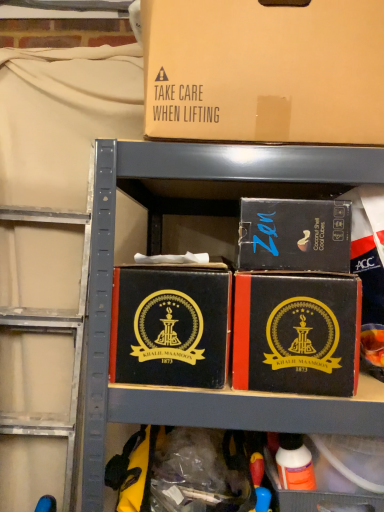
At what (x,y) coordinates should I click in order to perform the action: click on black leather box at center, which ranks as the 2th box in bottom-to-top order. Please return your answer as a coordinate pair (x, y). Image resolution: width=384 pixels, height=512 pixels. Looking at the image, I should click on (170, 325).

Identify the location of brown cardboard box at upper center, the 4th box ordered from the bottom. (264, 71).

Describe the element at coordinates (294, 234) in the screenshot. The width and height of the screenshot is (384, 512). I see `black cardboard box at center, acting as the 2th box starting from the top` at that location.

The image size is (384, 512). What do you see at coordinates (296, 333) in the screenshot? I see `black cardboard box at center, which appears as the first box when ordered from the bottom` at bounding box center [296, 333].

Find the location of `orange matte bottle at lower right`. orange matte bottle at lower right is located at coordinates (294, 463).

Who is more distant, black cardboard box at center, placed as the 3th box when sorted from bottom to top, or brown cardboard box at upper center, the 4th box ordered from the bottom?

Positioned behind is black cardboard box at center, placed as the 3th box when sorted from bottom to top.

Is black cardboard box at center, placed as the 3th box when sorted from bottom to top, far from brown cardboard box at upper center, the 4th box ordered from the bottom?

No, black cardboard box at center, placed as the 3th box when sorted from bottom to top, is not far away from brown cardboard box at upper center, the 4th box ordered from the bottom.

How distant is black cardboard box at center, placed as the 3th box when sorted from bottom to top, from brown cardboard box at upper center, marked as the first box in a top-to-bottom arrangement?

black cardboard box at center, placed as the 3th box when sorted from bottom to top, is 7.03 inches away from brown cardboard box at upper center, marked as the first box in a top-to-bottom arrangement.

Can you confirm if black cardboard box at center, which appears as the first box when ordered from the bottom, is taller than brown cardboard box at upper center, marked as the first box in a top-to-bottom arrangement?

Incorrect, the height of black cardboard box at center, which appears as the first box when ordered from the bottom, is not larger of that of brown cardboard box at upper center, marked as the first box in a top-to-bottom arrangement.

Considering the relative positions of black cardboard box at center, which appears as the first box when ordered from the bottom, and brown cardboard box at upper center, the 4th box ordered from the bottom, in the image provided, is black cardboard box at center, which appears as the first box when ordered from the bottom, to the left or to the right of brown cardboard box at upper center, the 4th box ordered from the bottom,?

Clearly, black cardboard box at center, which appears as the first box when ordered from the bottom, is on the right of brown cardboard box at upper center, the 4th box ordered from the bottom, in the image.

Considering the positions of objects black cardboard box at center, acting as the 2th box starting from the top, and orange matte bottle at lower right in the image provided, who is more to the right, black cardboard box at center, acting as the 2th box starting from the top, or orange matte bottle at lower right?

From the viewer's perspective, orange matte bottle at lower right appears more on the right side.

Is black cardboard box at center, acting as the 2th box starting from the top, positioned behind orange matte bottle at lower right?

That is False.

Considering the relative sizes of black cardboard box at center, placed as the 3th box when sorted from bottom to top, and orange matte bottle at lower right in the image provided, is black cardboard box at center, placed as the 3th box when sorted from bottom to top, shorter than orange matte bottle at lower right?

Indeed, black cardboard box at center, placed as the 3th box when sorted from bottom to top, has a lesser height compared to orange matte bottle at lower right.

From a real-world perspective, between black cardboard box at center, acting as the 2th box starting from the top, and orange matte bottle at lower right, who is vertically lower?

In real-world perspective, orange matte bottle at lower right is lower.

Visually, is brown cardboard box at upper center, the 4th box ordered from the bottom, positioned to the left or to the right of orange matte bottle at lower right?

brown cardboard box at upper center, the 4th box ordered from the bottom, is to the left of orange matte bottle at lower right.

Which of these two, brown cardboard box at upper center, marked as the first box in a top-to-bottom arrangement, or orange matte bottle at lower right, stands taller?

Standing taller between the two is brown cardboard box at upper center, marked as the first box in a top-to-bottom arrangement.

Can you tell me how much brown cardboard box at upper center, marked as the first box in a top-to-bottom arrangement, and orange matte bottle at lower right differ in facing direction?

The angle between the facing direction of brown cardboard box at upper center, marked as the first box in a top-to-bottom arrangement, and the facing direction of orange matte bottle at lower right is 0.851 degrees.

Based on the photo, is orange matte bottle at lower right inside brown cardboard box at upper center, the 4th box ordered from the bottom?

Definitely not — orange matte bottle at lower right is not inside brown cardboard box at upper center, the 4th box ordered from the bottom.

Considering the relative sizes of orange matte bottle at lower right and black cardboard box at center, which appears as the first box when ordered from the bottom, in the image provided, is orange matte bottle at lower right wider than black cardboard box at center, which appears as the first box when ordered from the bottom,?

In fact, orange matte bottle at lower right might be narrower than black cardboard box at center, which appears as the first box when ordered from the bottom.

How many degrees apart are the facing directions of orange matte bottle at lower right and black cardboard box at center, which appears as the first box when ordered from the bottom?

orange matte bottle at lower right and black cardboard box at center, which appears as the first box when ordered from the bottom, are facing 2.98 degrees away from each other.

Is orange matte bottle at lower right inside or outside of black cardboard box at center, the fourth box in the top-to-bottom sequence?

orange matte bottle at lower right is not inside black cardboard box at center, the fourth box in the top-to-bottom sequence, it's outside.

The image size is (384, 512). I want to click on toy behind the black cardboard box at center, which appears as the first box when ordered from the bottom, so click(294, 463).

Which object is wider, orange matte bottle at lower right or brown cardboard box at upper center, marked as the first box in a top-to-bottom arrangement?

Wider between the two is brown cardboard box at upper center, marked as the first box in a top-to-bottom arrangement.

Is orange matte bottle at lower right further to the viewer compared to brown cardboard box at upper center, the 4th box ordered from the bottom?

That is True.

Is orange matte bottle at lower right far away from brown cardboard box at upper center, marked as the first box in a top-to-bottom arrangement?

No, orange matte bottle at lower right is not far from brown cardboard box at upper center, marked as the first box in a top-to-bottom arrangement.

Between orange matte bottle at lower right and brown cardboard box at upper center, the 4th box ordered from the bottom, which one has less height?

With less height is orange matte bottle at lower right.

Is black cardboard box at center, the fourth box in the top-to-bottom sequence, looking in the opposite direction of black cardboard box at center, placed as the 3th box when sorted from bottom to top?

black cardboard box at center, the fourth box in the top-to-bottom sequence, does not have its back to black cardboard box at center, placed as the 3th box when sorted from bottom to top.

Is black cardboard box at center, which appears as the first box when ordered from the bottom, inside the boundaries of black cardboard box at center, placed as the 3th box when sorted from bottom to top, or outside?

black cardboard box at center, which appears as the first box when ordered from the bottom, lies outside black cardboard box at center, placed as the 3th box when sorted from bottom to top.

At what (x,y) coordinates should I click in order to perform the action: click on the 2nd box positioned above the black cardboard box at center, the fourth box in the top-to-bottom sequence (from a real-world perspective). Please return your answer as a coordinate pair (x, y). The height and width of the screenshot is (512, 384). Looking at the image, I should click on (294, 234).

From the black cardboard box at center, placed as the 3th box when sorted from bottom to top, count 3rd boxs forward and point to it. Please provide its 2D coordinates.

[(264, 71)]

Which box is the 2nd one when counting from the right side of the brown cardboard box at upper center, marked as the first box in a top-to-bottom arrangement? Please provide its 2D coordinates.

[(296, 333)]

From the image, which object appears to be nearer to black cardboard box at center, the fourth box in the top-to-bottom sequence, black leather box at center, the third box viewed from the top, or orange matte bottle at lower right?

black leather box at center, the third box viewed from the top, is closer to black cardboard box at center, the fourth box in the top-to-bottom sequence.

Which object lies nearer to the anchor point black leather box at center, which ranks as the 2th box in bottom-to-top order, orange matte bottle at lower right or black cardboard box at center, which appears as the first box when ordered from the bottom?

Based on the image, black cardboard box at center, which appears as the first box when ordered from the bottom, appears to be nearer to black leather box at center, which ranks as the 2th box in bottom-to-top order.

Based on the photo, considering their positions, is black leather box at center, which ranks as the 2th box in bottom-to-top order, positioned further to black cardboard box at center, acting as the 2th box starting from the top, than orange matte bottle at lower right?

The object further to black cardboard box at center, acting as the 2th box starting from the top, is orange matte bottle at lower right.

Based on their spatial positions, is black cardboard box at center, the fourth box in the top-to-bottom sequence, or brown cardboard box at upper center, marked as the first box in a top-to-bottom arrangement, closer to orange matte bottle at lower right?

black cardboard box at center, the fourth box in the top-to-bottom sequence, is closer to orange matte bottle at lower right.

Considering their positions, is brown cardboard box at upper center, marked as the first box in a top-to-bottom arrangement, positioned closer to black cardboard box at center, the fourth box in the top-to-bottom sequence, than black cardboard box at center, acting as the 2th box starting from the top?

Among the two, black cardboard box at center, acting as the 2th box starting from the top, is located nearer to black cardboard box at center, the fourth box in the top-to-bottom sequence.

When comparing their distances from brown cardboard box at upper center, the 4th box ordered from the bottom, does black leather box at center, which ranks as the 2th box in bottom-to-top order, or orange matte bottle at lower right seem further?

orange matte bottle at lower right lies further to brown cardboard box at upper center, the 4th box ordered from the bottom, than the other object.

Based on their spatial positions, is black cardboard box at center, placed as the 3th box when sorted from bottom to top, or black cardboard box at center, the fourth box in the top-to-bottom sequence, further from orange matte bottle at lower right?

The object further to orange matte bottle at lower right is black cardboard box at center, placed as the 3th box when sorted from bottom to top.

When comparing their distances from black cardboard box at center, placed as the 3th box when sorted from bottom to top, does brown cardboard box at upper center, marked as the first box in a top-to-bottom arrangement, or black cardboard box at center, which appears as the first box when ordered from the bottom, seem further?

Among the two, brown cardboard box at upper center, marked as the first box in a top-to-bottom arrangement, is located further to black cardboard box at center, placed as the 3th box when sorted from bottom to top.

Where is `box between brown cardboard box at upper center, marked as the first box in a top-to-bottom arrangement, and black leather box at center, the third box viewed from the top, in the up-down direction`? The image size is (384, 512). box between brown cardboard box at upper center, marked as the first box in a top-to-bottom arrangement, and black leather box at center, the third box viewed from the top, in the up-down direction is located at coordinates (294, 234).

This screenshot has height=512, width=384. I want to click on box between black leather box at center, the third box viewed from the top, and orange matte bottle at lower right, in the vertical direction, so click(296, 333).